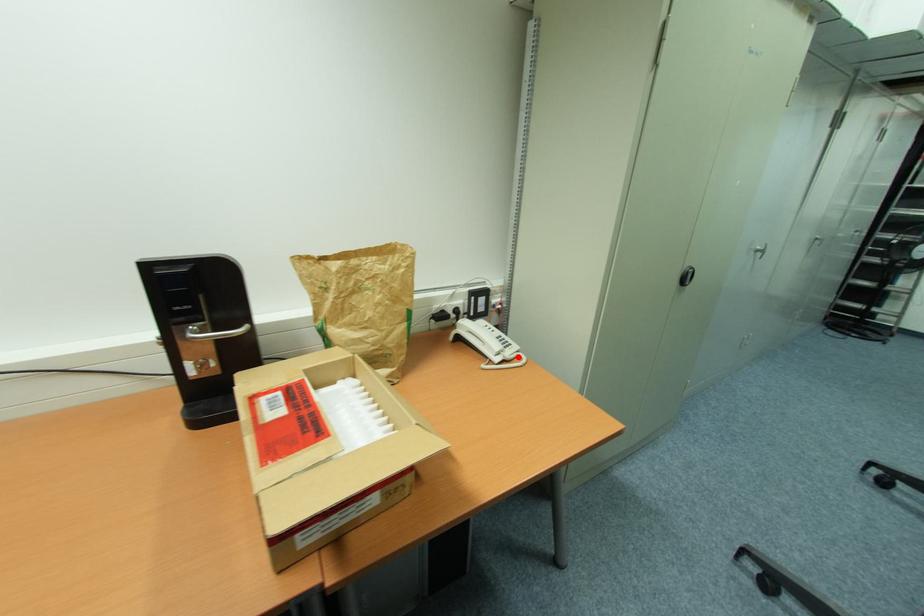
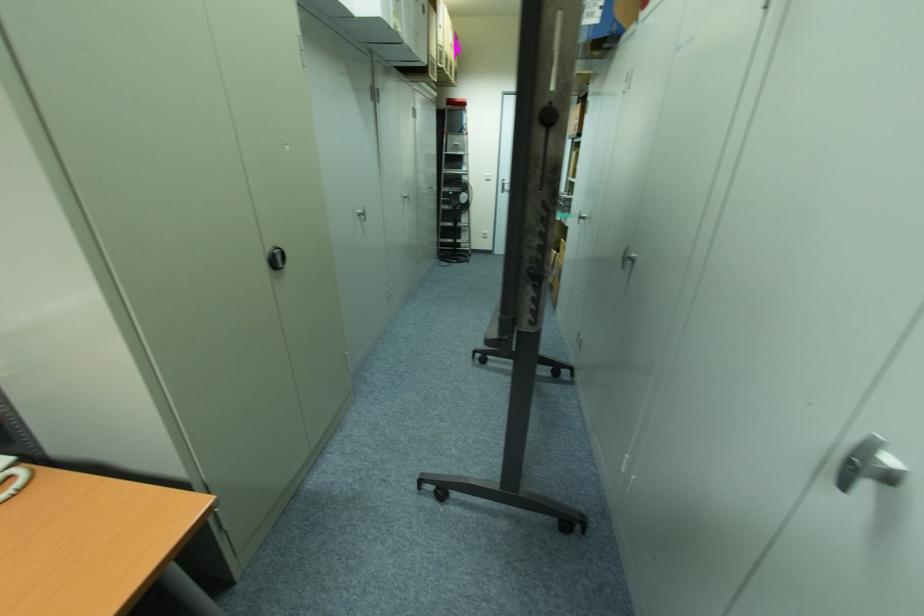
The point at the highlighted location is marked in the first image. Where is the corresponding point in the second image?

(8, 479)